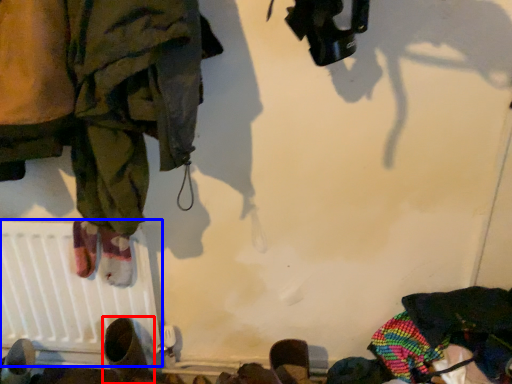
Question: Among these objects, which one is nearest to the camera, footwear (highlighted by a red box) or radiator (highlighted by a blue box)?

Choices:
 (A) footwear
 (B) radiator

Answer: (A)